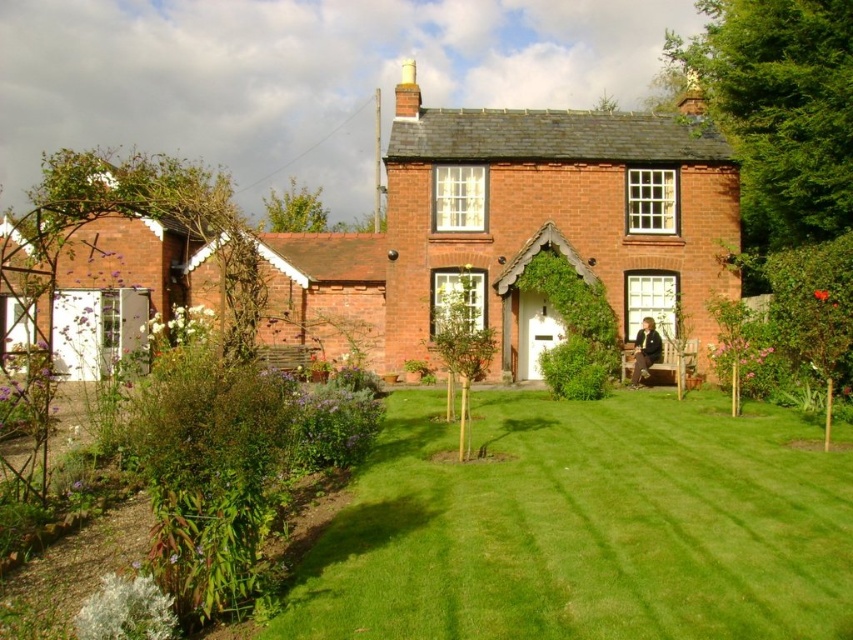
Between point (541, 570) and point (299, 250), which one is positioned in front?

Point (541, 570) is in front.

Which of these two, green smooth lawn at center or red brick cottage at center, stands shorter?

green smooth lawn at center is shorter.

This screenshot has height=640, width=853. Describe the element at coordinates (585, 525) in the screenshot. I see `green smooth lawn at center` at that location.

Image resolution: width=853 pixels, height=640 pixels. I want to click on green smooth lawn at center, so click(585, 525).